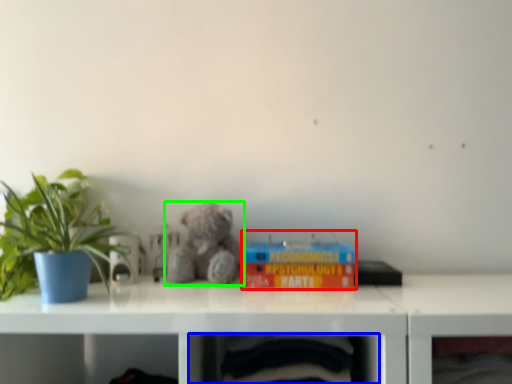
Question: Which is nearer to the toy (highlighted by a red box)? shelf (highlighted by a blue box) or teddy bear (highlighted by a green box).

Choices:
 (A) shelf
 (B) teddy bear

Answer: (B)